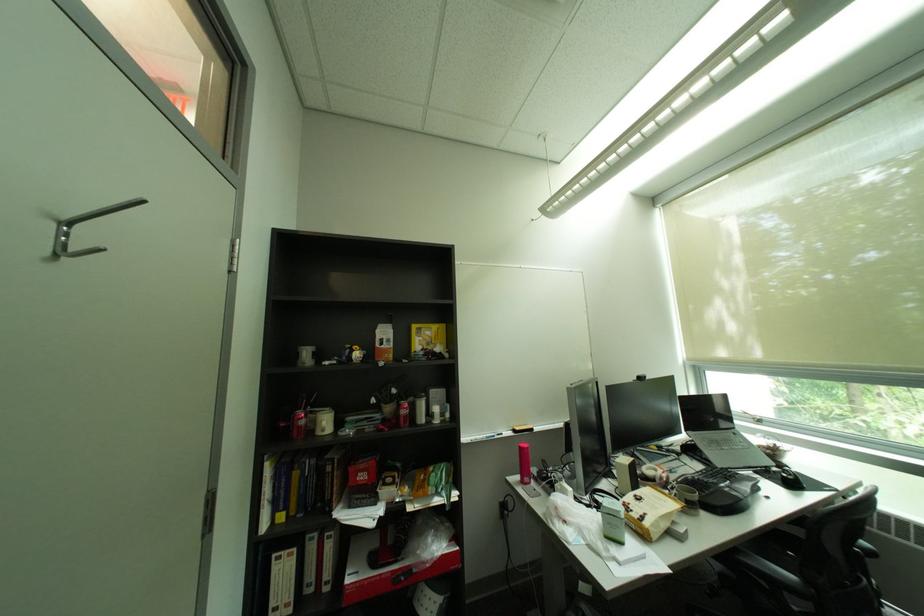
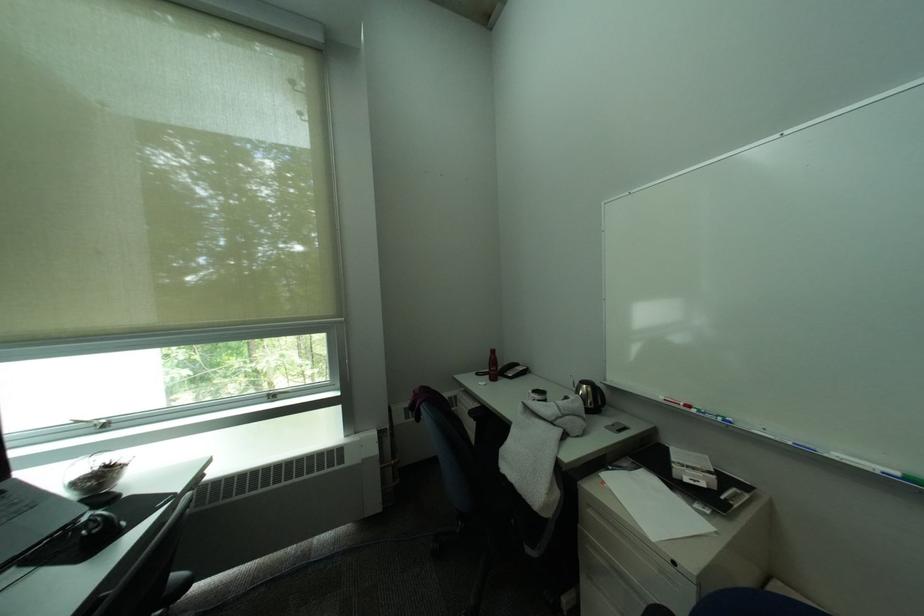
The point at (801, 477) is marked in the first image. Where is the corresponding point in the second image?

(106, 528)